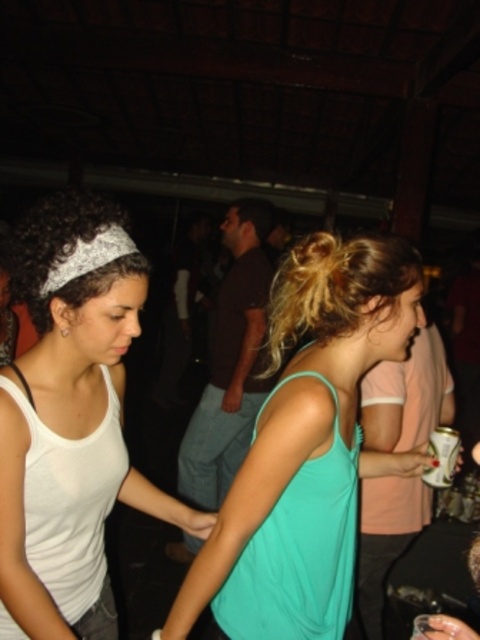
You are a fashion designer observing the two women at a party. You notice the teal fabric tank top at center and the white fabric tank top at left. Which tank top is wider?

The teal fabric tank top at center is wider than the white fabric tank top at left according to the description.